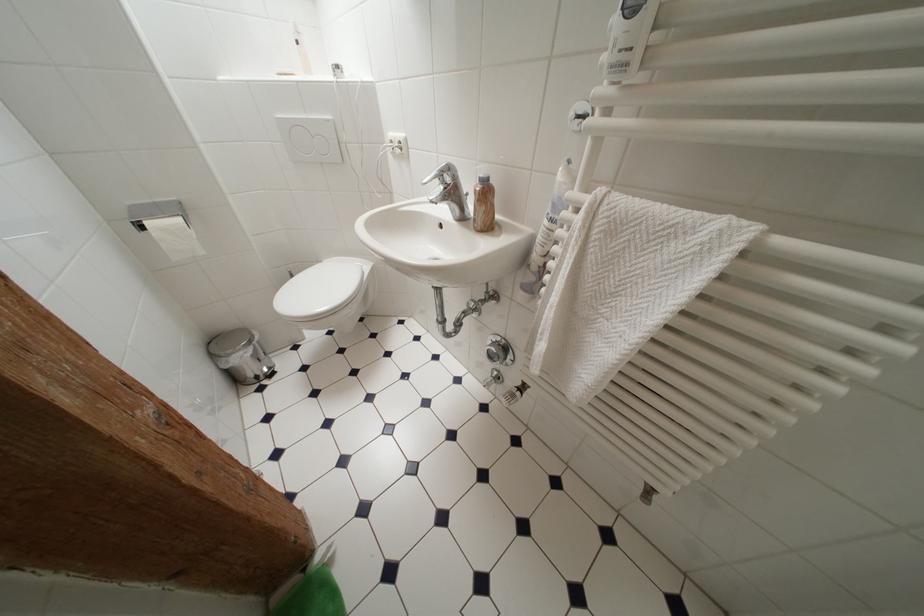
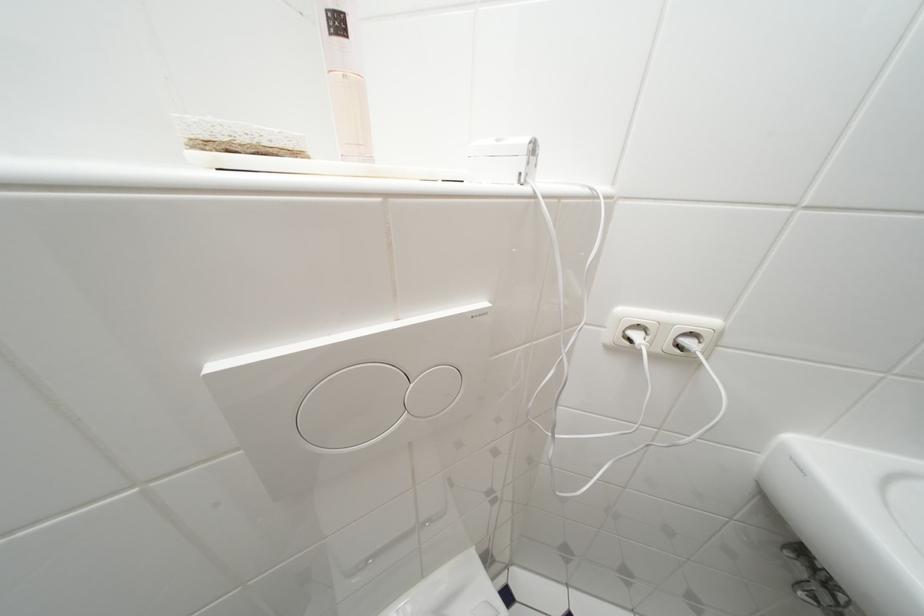
Where in the second image is the point corresponding to pixel 304 46 from the first image?

(345, 26)